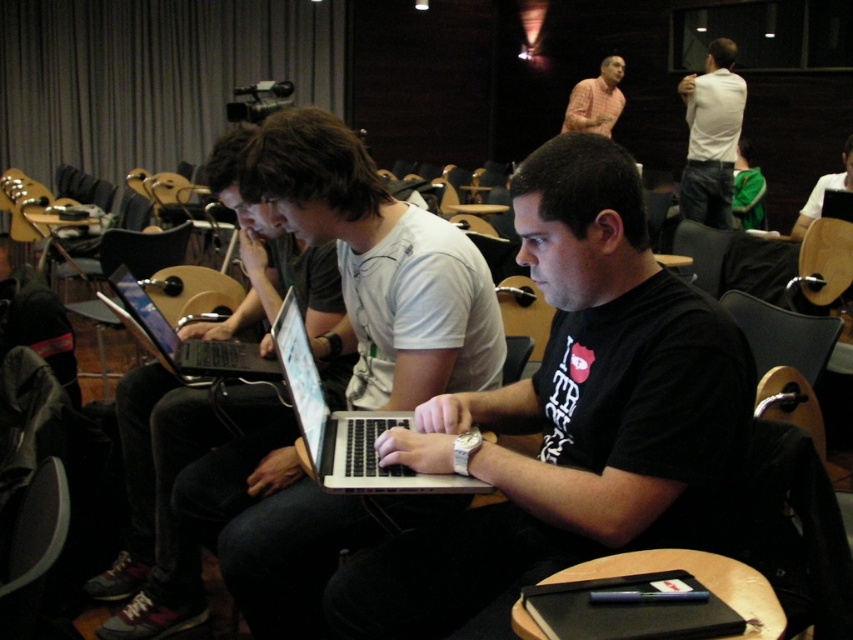
Which of these two, white shirt at upper right or pink shirt at upper center, stands taller?

Standing taller between the two is white shirt at upper right.

Does white shirt at upper right appear on the left side of pink shirt at upper center?

No, white shirt at upper right is not to the left of pink shirt at upper center.

Image resolution: width=853 pixels, height=640 pixels. What do you see at coordinates (711, 136) in the screenshot? I see `white shirt at upper right` at bounding box center [711, 136].

Where is `white shirt at upper right`? This screenshot has height=640, width=853. white shirt at upper right is located at coordinates (711, 136).

What are the coordinates of `white shirt at upper right` in the screenshot? It's located at (711, 136).

Does point (703, 184) lie in front of point (140, 317)?

No, (703, 184) is behind (140, 317).

Locate an element on the screen. The width and height of the screenshot is (853, 640). white shirt at upper right is located at coordinates (711, 136).

Measure the distance between matte black laptop at center and camera.

5.25 feet

Is matte black laptop at center wider than pink shirt at upper center?

Yes.

Is point (135, 593) behind point (567, 120)?

No.

Find the location of a particular element. matte black laptop at center is located at coordinates (172, 474).